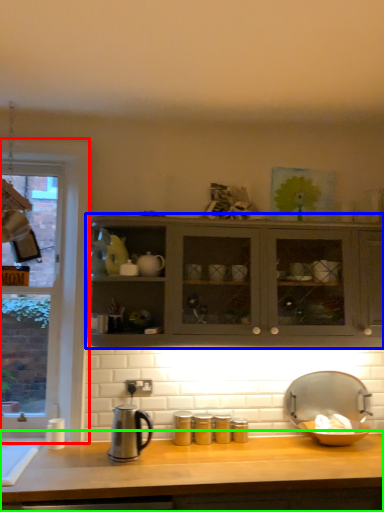
Question: Based on their relative distances, which object is farther from window (highlighted by a red box)? Choose from cabinetry (highlighted by a blue box) and countertop (highlighted by a green box).

Choices:
 (A) cabinetry
 (B) countertop

Answer: (B)